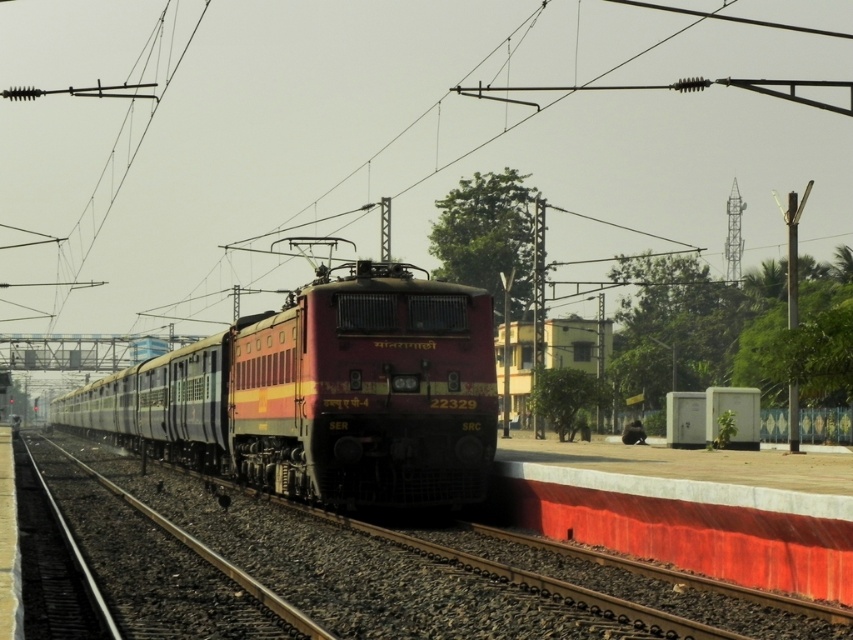
You are a passenger waiting on the platform and see the matte red locomotive at center and the smooth metal train track at center. Which object takes up more space in the image?

The matte red locomotive at center is larger in size than the smooth metal train track at center, so it takes up more space in the image.

You are a railway engineer assessing the safety of the train tracks. You notice the matte red locomotive at center and the smooth metal train track at center. Based on their widths, which object is more likely to require adjustments to ensure proper clearance?

The matte red locomotive at center might be wider than the smooth metal train track at center, so adjustments may be needed to ensure the locomotive fits within the track dimensions safely.

You are standing on the platform and want to take a photo of the matte red locomotive at center. The platform has a safety barrier along its edge. Where should you stand to ensure the entire locomotive is in the frame without crossing the safety barrier?

Since the matte red locomotive at center is positioned at coordinates point (322, 394), you should stand near the center of the platform behind the safety barrier to capture the entire locomotive in your photo without crossing the barrier.